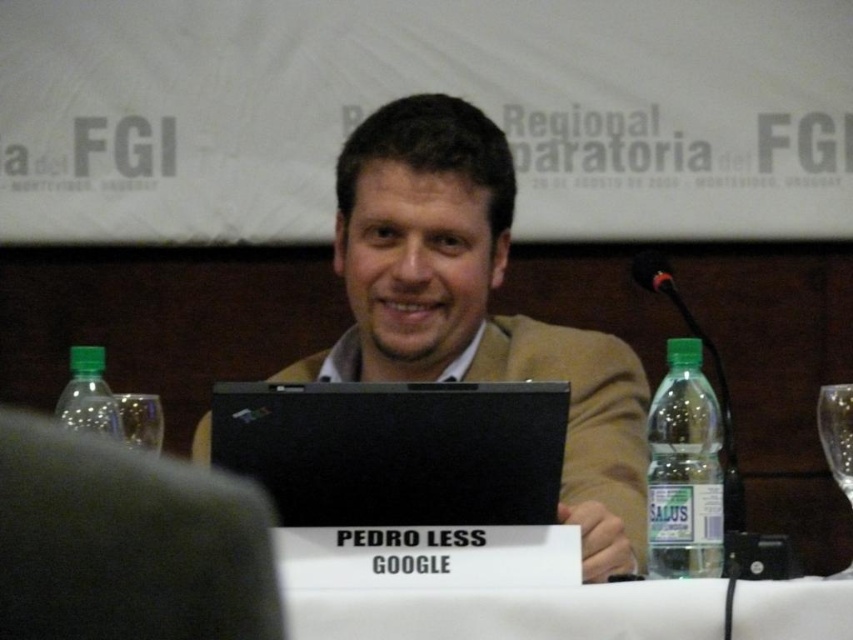
You are a photographer adjusting your camera to capture the scene. You notice two points of interest marked at coordinates point (x=395, y=355) and point (x=48, y=621). Which point is closer to your camera lens?

Point (x=48, y=621) is closer to the camera lens because it is less further than point (x=395, y=355).